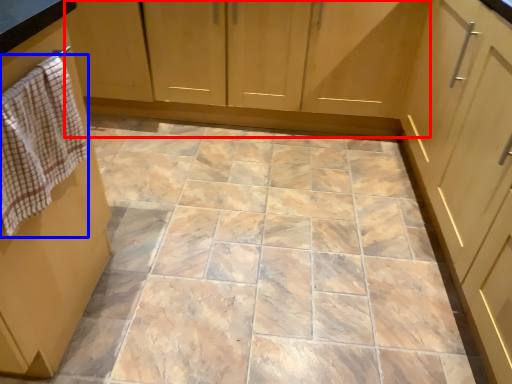
Question: Which object appears farthest to the camera in this image, cabinetry (highlighted by a red box) or hand towel (highlighted by a blue box)?

Choices:
 (A) cabinetry
 (B) hand towel

Answer: (A)